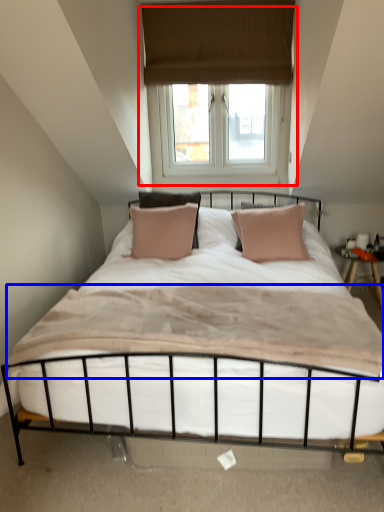
Question: Which object appears farthest to the camera in this image, window (highlighted by a red box) or mattress (highlighted by a blue box)?

Choices:
 (A) window
 (B) mattress

Answer: (A)